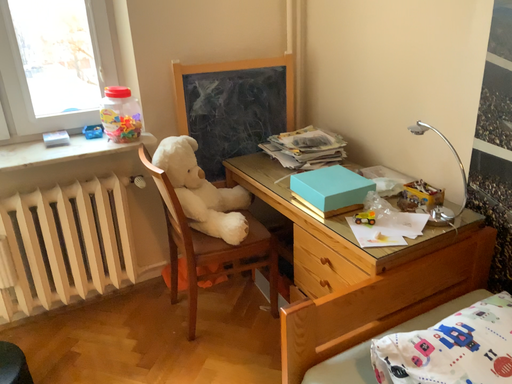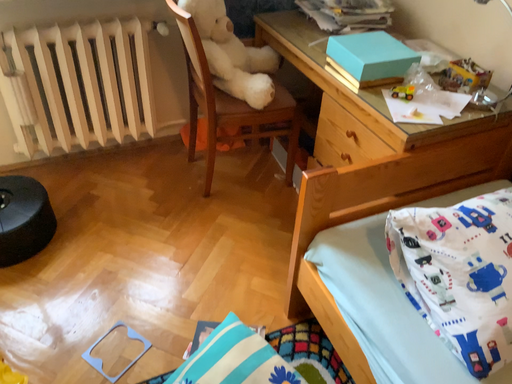
Question: Which way did the camera rotate in the video?

Choices:
 (A) rotated downward
 (B) rotated upward

Answer: (A)